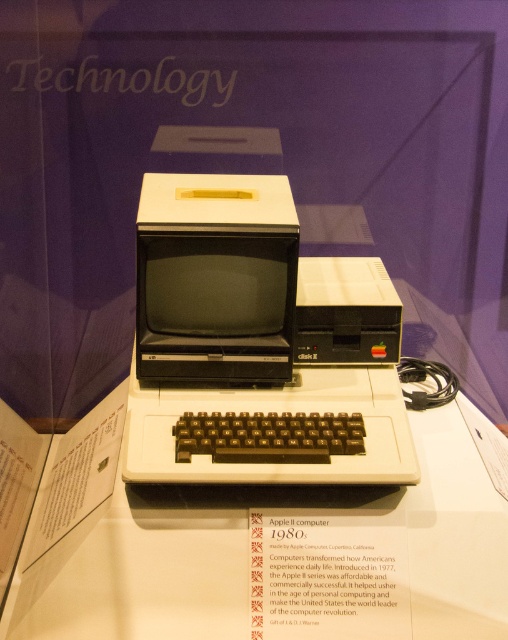
Question: Which object appears farthest from the camera in this image?

Choices:
 (A) white plastic table at center
 (B) black plastic keyboard at center
 (C) matte black monitor at center

Answer: (C)

Question: Is matte black monitor at center to the right of black plastic keyboard at center from the viewer's perspective?

Choices:
 (A) yes
 (B) no

Answer: (B)

Question: Which object appears closest to the camera in this image?

Choices:
 (A) matte black monitor at center
 (B) black plastic keyboard at center

Answer: (B)

Question: Is white plastic table at center to the left of black plastic keyboard at center from the viewer's perspective?

Choices:
 (A) yes
 (B) no

Answer: (A)

Question: Which object appears farthest from the camera in this image?

Choices:
 (A) black plastic keyboard at center
 (B) white plastic table at center

Answer: (A)

Question: Does white plastic table at center have a smaller size compared to black plastic keyboard at center?

Choices:
 (A) no
 (B) yes

Answer: (A)